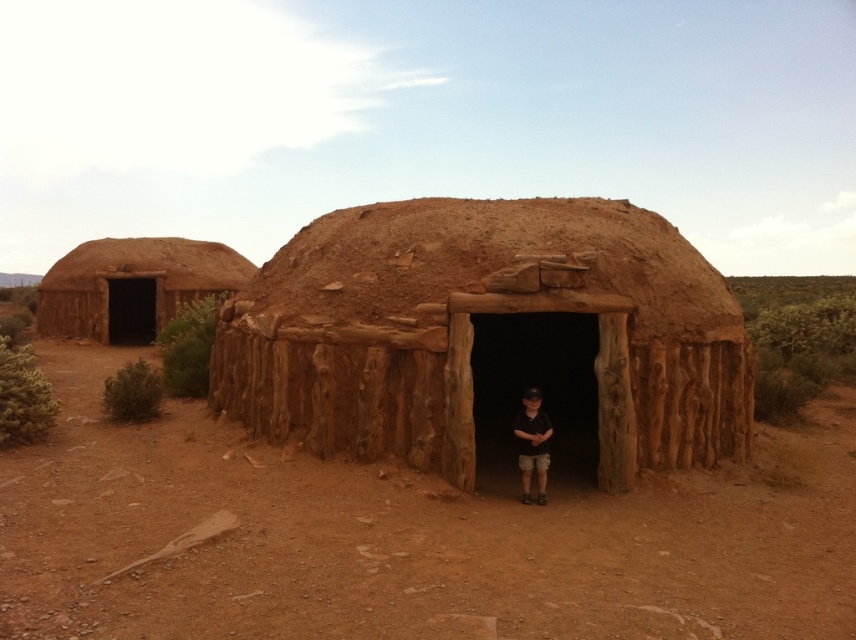
Is brown mud hut at left thinner than black cotton shirt at center?

No, brown mud hut at left is not thinner than black cotton shirt at center.

Between brown mud hut at left and black cotton shirt at center, which one is positioned lower?

Positioned lower is black cotton shirt at center.

Between point (85, 266) and point (530, 419), which one is positioned in front?

Point (530, 419)

What are the coordinates of `brown mud hut at left` in the screenshot? It's located at (132, 285).

Is brown mud hut at center taller than black cotton shirt at center?

In fact, brown mud hut at center may be shorter than black cotton shirt at center.

Between brown mud hut at center and black cotton shirt at center, which one appears on the right side from the viewer's perspective?

Positioned to the right is black cotton shirt at center.

Where is `brown mud hut at center`? The width and height of the screenshot is (856, 640). brown mud hut at center is located at coordinates (486, 332).

Is brown mud hut at center below brown mud hut at left?

Yes.

Can you confirm if brown mud hut at center is positioned above brown mud hut at left?

No, brown mud hut at center is not above brown mud hut at left.

Is point (658, 294) closer to viewer compared to point (111, 282)?

That is True.

Where is `brown mud hut at center`? brown mud hut at center is located at coordinates (486, 332).